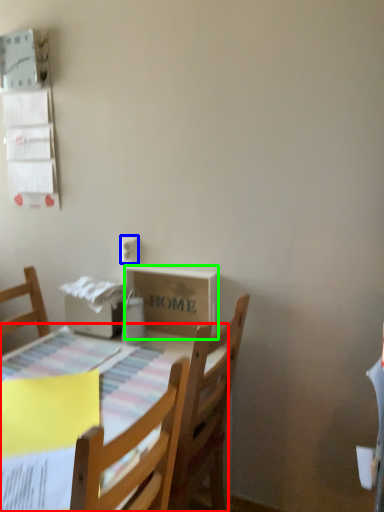
Question: Considering the real-world distances, which object is closest to table (highlighted by a red box)? electric outlet (highlighted by a blue box) or cardboard box (highlighted by a green box).

Choices:
 (A) electric outlet
 (B) cardboard box

Answer: (B)